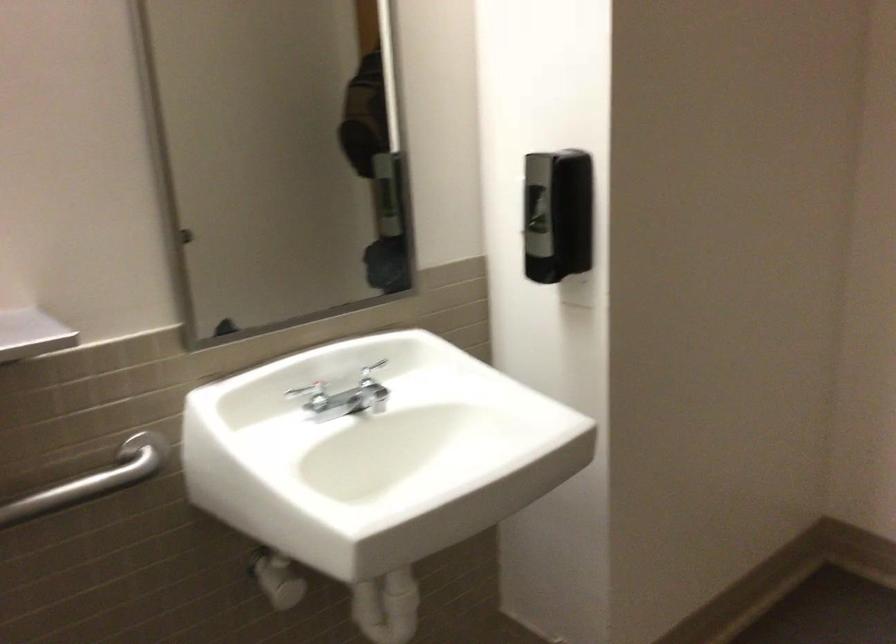
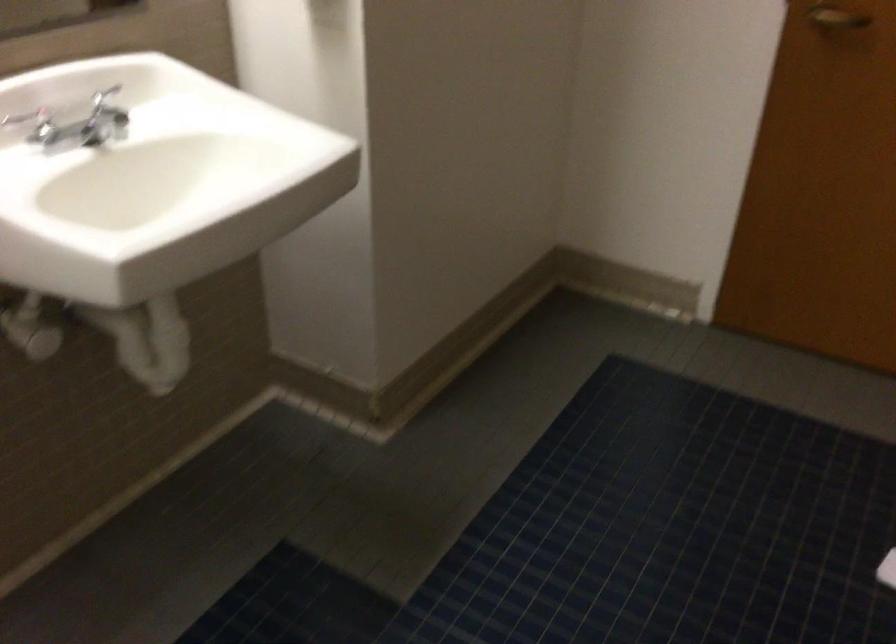
Question: In a continuous first-person perspective shot, in which direction is the camera moving?

Choices:
 (A) Left
 (B) Right
 (C) Forward
 (D) Backward

Answer: (A)